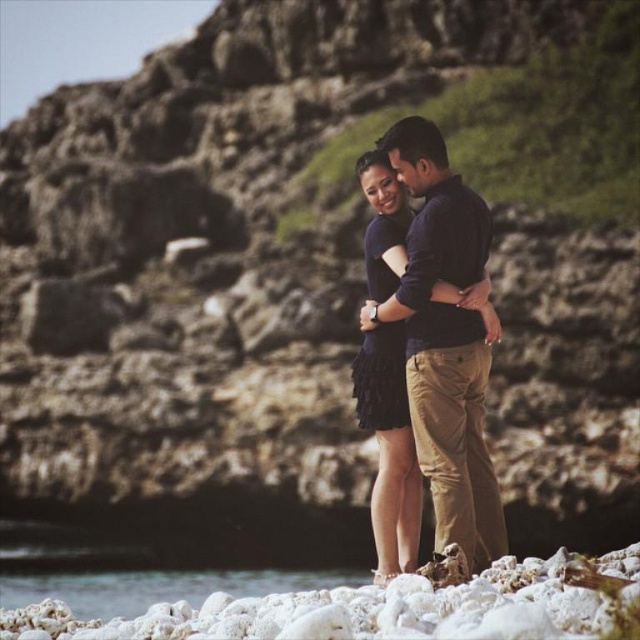
Question: Which point is farther to the camera?

Choices:
 (A) (438, 260)
 (B) (252, 627)
 (C) (20, 589)

Answer: (C)

Question: Does dark blue cotton shirt at center appear on the left side of white sand at lower left?

Choices:
 (A) no
 (B) yes

Answer: (A)

Question: Does white coral rocks at lower center appear on the right side of white sand at lower left?

Choices:
 (A) no
 (B) yes

Answer: (B)

Question: Which point is closer to the camera?

Choices:
 (A) dark blue cotton shirt at center
 (B) white coral rocks at lower center

Answer: (B)

Question: Which point is closer to the camera taking this photo?

Choices:
 (A) (35, 576)
 (B) (6, 627)
 (C) (429, 208)

Answer: (B)

Question: Does dark blue cotton shirt at center appear over white sand at lower left?

Choices:
 (A) yes
 (B) no

Answer: (A)